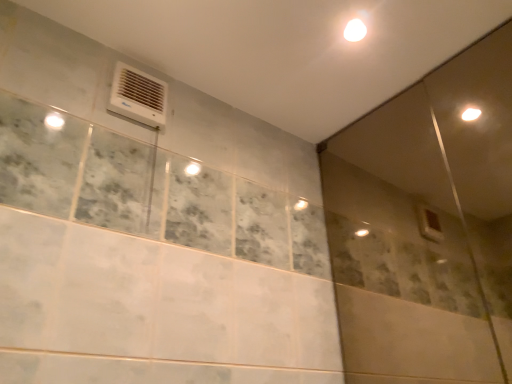
Question: From a real-world perspective, is white plastic air conditioning unit at upper left over transparent glass screen door at upper right?

Choices:
 (A) no
 (B) yes

Answer: (B)

Question: Could you tell me if white plastic air conditioning unit at upper left is facing transparent glass screen door at upper right?

Choices:
 (A) yes
 (B) no

Answer: (B)

Question: Does white plastic air conditioning unit at upper left come behind transparent glass screen door at upper right?

Choices:
 (A) yes
 (B) no

Answer: (A)

Question: Can you see white plastic air conditioning unit at upper left touching transparent glass screen door at upper right?

Choices:
 (A) yes
 (B) no

Answer: (B)

Question: From the image's perspective, is white plastic air conditioning unit at upper left below transparent glass screen door at upper right?

Choices:
 (A) yes
 (B) no

Answer: (B)

Question: Can you confirm if white plastic air conditioning unit at upper left is positioned to the left of transparent glass screen door at upper right?

Choices:
 (A) yes
 (B) no

Answer: (A)

Question: Could white glossy light at upper center be considered to be inside transparent glass screen door at upper right?

Choices:
 (A) yes
 (B) no

Answer: (B)

Question: Does transparent glass screen door at upper right have a greater width compared to white glossy light at upper center?

Choices:
 (A) no
 (B) yes

Answer: (A)

Question: Is transparent glass screen door at upper right thinner than white glossy light at upper center?

Choices:
 (A) yes
 (B) no

Answer: (A)

Question: Considering the relative sizes of transparent glass screen door at upper right and white glossy light at upper center in the image provided, is transparent glass screen door at upper right taller than white glossy light at upper center?

Choices:
 (A) no
 (B) yes

Answer: (B)

Question: Can you confirm if transparent glass screen door at upper right is bigger than white glossy light at upper center?

Choices:
 (A) no
 (B) yes

Answer: (B)

Question: Can you confirm if transparent glass screen door at upper right is shorter than white glossy light at upper center?

Choices:
 (A) no
 (B) yes

Answer: (A)

Question: From a real-world perspective, does transparent glass screen door at upper right stand above white plastic air conditioning unit at upper left?

Choices:
 (A) yes
 (B) no

Answer: (B)